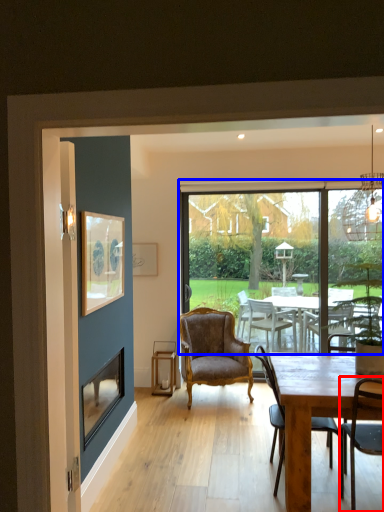
Question: Which point is further to the camera, chair (highlighted by a red box) or window (highlighted by a blue box)?

Choices:
 (A) chair
 (B) window

Answer: (B)